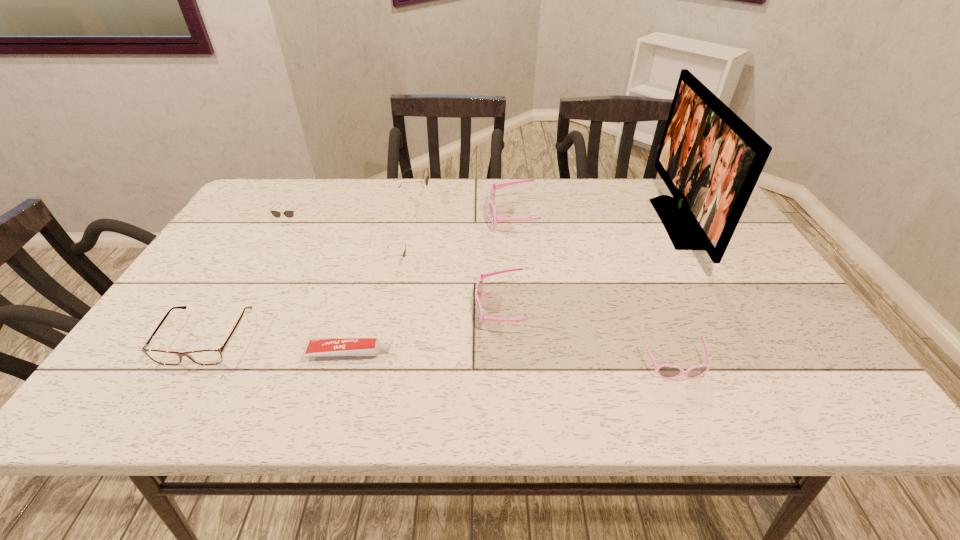
The height and width of the screenshot is (540, 960). Identify the location of monitor at the far edge. (710, 160).

Locate an element on the screen. object that is at the near edge is located at coordinates (666, 371).

What are the coordinates of `sunglasses at the left edge` in the screenshot? It's located at tap(289, 213).

Identify the location of spectacles that is at the left edge. Image resolution: width=960 pixels, height=540 pixels. (211, 356).

Locate an element on the screen. object situated at the right edge is located at coordinates (710, 160).

This screenshot has height=540, width=960. In order to click on object present at the far left corner in this screenshot , I will do `click(289, 213)`.

You are a GUI agent. You are given a task and a screenshot of the screen. Output one action in this format:
    pyautogui.click(x=<x>, y=<y>)
    Task: Click on the object situated at the far right corner
    The image size is (960, 540).
    Given the screenshot: What is the action you would take?
    pyautogui.click(x=710, y=160)

The image size is (960, 540). I want to click on free region at the far edge of the desktop, so click(623, 199).

The height and width of the screenshot is (540, 960). Find the location of `free space at the near edge`. free space at the near edge is located at coordinates (407, 377).

This screenshot has height=540, width=960. In the image, there is a desktop. In order to click on vacant space at the left edge in this screenshot , I will do point(224,268).